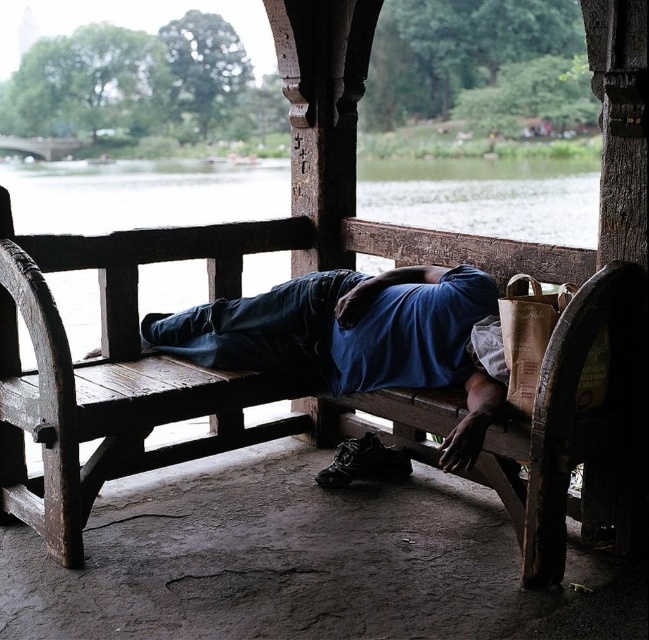
Question: Is rustic wood bench at center to the right of blue fabric at center from the viewer's perspective?

Choices:
 (A) no
 (B) yes

Answer: (A)

Question: Which point is closer to the camera?

Choices:
 (A) (380, 336)
 (B) (10, 232)

Answer: (A)

Question: Is rustic wood bench at center to the left of blue fabric at center from the viewer's perspective?

Choices:
 (A) no
 (B) yes

Answer: (B)

Question: Can you confirm if rustic wood bench at center is positioned to the left of blue fabric at center?

Choices:
 (A) no
 (B) yes

Answer: (B)

Question: Which point is farther to the camera?

Choices:
 (A) rustic wood bench at center
 (B) blue fabric at center

Answer: (A)